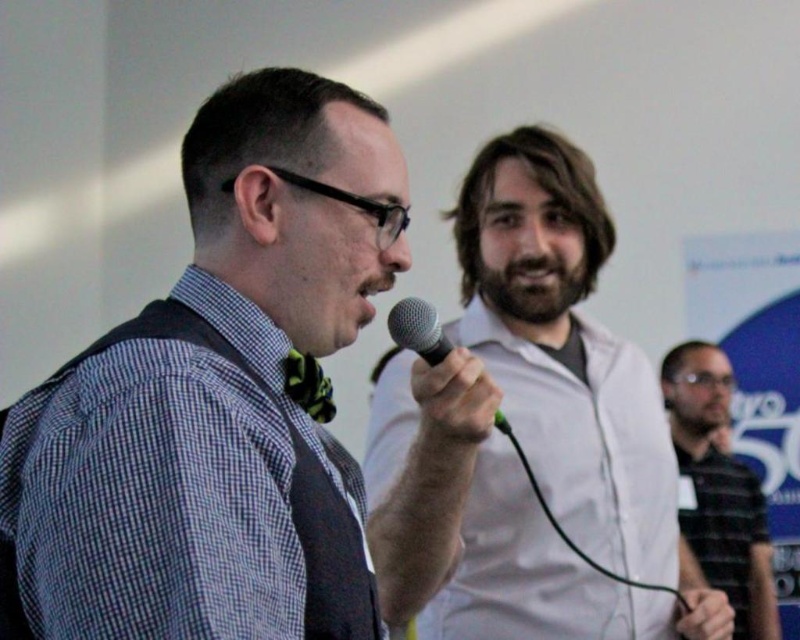
Is black metallic microphone at center further to camera compared to green patterned bow tie at center?

Yes, black metallic microphone at center is behind green patterned bow tie at center.

Find the location of a particular element. Image resolution: width=800 pixels, height=640 pixels. black metallic microphone at center is located at coordinates (418, 330).

Between checkered fabric shirt at center and white matte shirt at center, which one appears on the left side from the viewer's perspective?

From the viewer's perspective, checkered fabric shirt at center appears more on the left side.

The height and width of the screenshot is (640, 800). What are the coordinates of `checkered fabric shirt at center` in the screenshot? It's located at (218, 397).

Does checkered fabric shirt at center have a lesser width compared to striped cotton shirt at right?

Indeed, checkered fabric shirt at center has a lesser width compared to striped cotton shirt at right.

Between checkered fabric shirt at center and striped cotton shirt at right, which one has less height?

Result: checkered fabric shirt at center is shorter.

Who is more forward, (352, 189) or (764, 602)?

Point (352, 189)

The image size is (800, 640). I want to click on checkered fabric shirt at center, so (x=218, y=397).